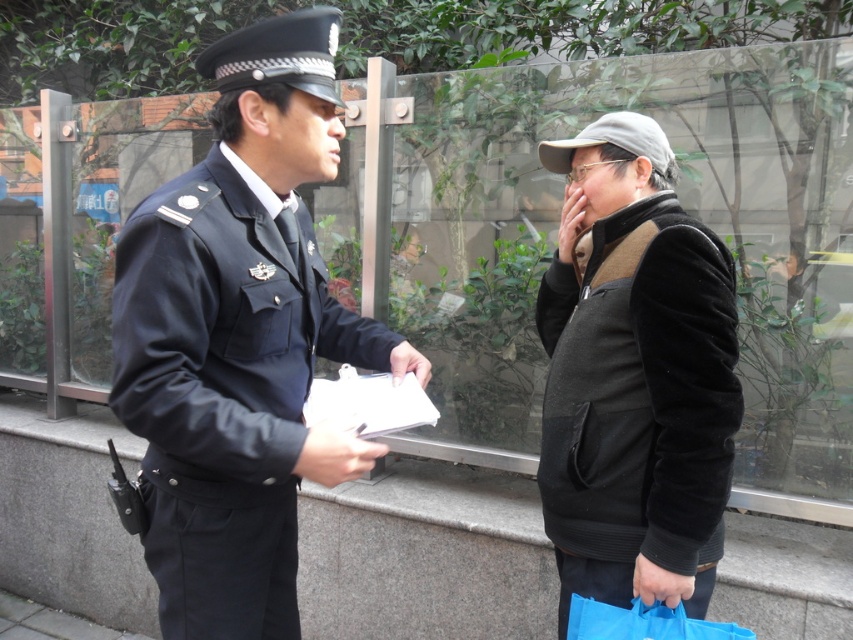
Question: Which point is closer to the camera taking this photo?

Choices:
 (A) (685, 321)
 (B) (334, 477)

Answer: (B)

Question: Does matte black uniform at center appear under velvet black vest at right?

Choices:
 (A) no
 (B) yes

Answer: (A)

Question: Which point is farther to the camera?

Choices:
 (A) (701, 512)
 (B) (291, 305)

Answer: (B)

Question: Does matte black uniform at center appear on the right side of velvet black vest at right?

Choices:
 (A) no
 (B) yes

Answer: (A)

Question: Does matte black uniform at center have a larger size compared to velvet black vest at right?

Choices:
 (A) yes
 (B) no

Answer: (A)

Question: Which point is closer to the camera?

Choices:
 (A) (564, 440)
 (B) (212, 328)

Answer: (B)